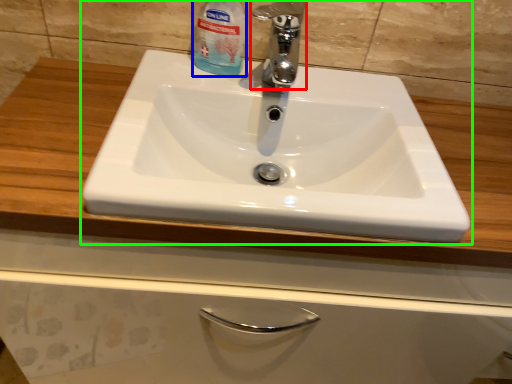
Question: Based on their relative distances, which object is nearer to tap (highlighted by a red box)? Choose from cleaning product (highlighted by a blue box) and sink (highlighted by a green box).

Choices:
 (A) cleaning product
 (B) sink

Answer: (A)